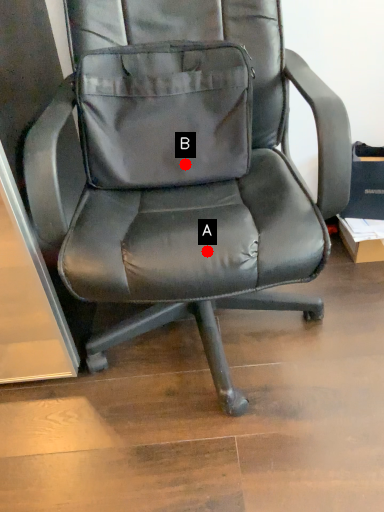
Question: Two points are circled on the image, labeled by A and B beside each circle. Which of the following is the farthest from the observer?

Choices:
 (A) A is further
 (B) B is further

Answer: (B)